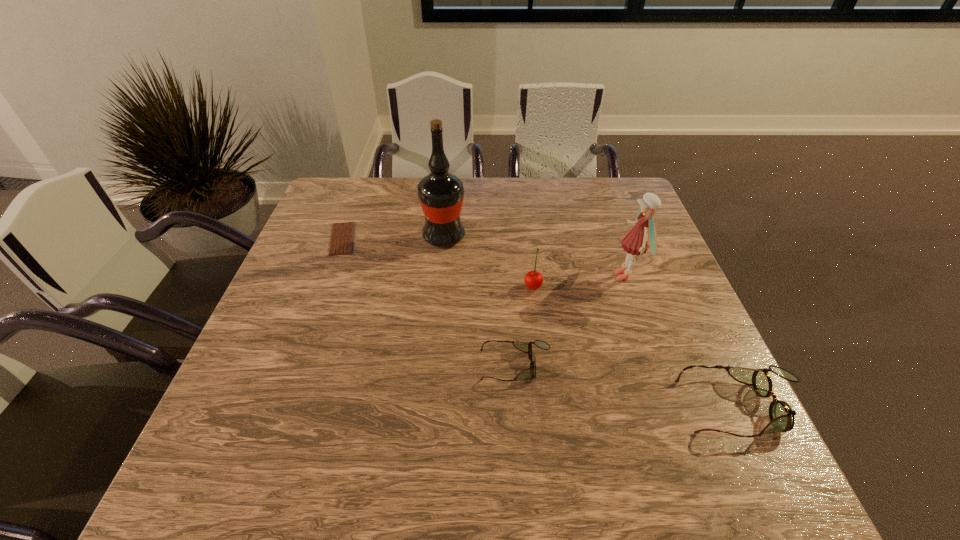
In the image, there is a desktop. Identify the location of vacant space at the far left corner. The image size is (960, 540). (338, 199).

At what (x,y) coordinates should I click in order to perform the action: click on vacant space at the near right corner of the desktop. Please return your answer as a coordinate pair (x, y). Looking at the image, I should click on (742, 411).

Where is `free area in between the right spectacles and the cherry`? The height and width of the screenshot is (540, 960). free area in between the right spectacles and the cherry is located at coordinates (636, 346).

Identify the location of free space between the shorter spectacles and the third tallest object. (524, 326).

This screenshot has width=960, height=540. What are the coordinates of `empty space between the second tallest object and the tallest object` in the screenshot? It's located at (535, 256).

Locate an element on the screen. free space between the fifth object from right to left and the fifth shortest object is located at coordinates point(535,256).

The image size is (960, 540). Identify the location of free space between the shorter spectacles and the tallest object. (480, 301).

You are a GUI agent. You are given a task and a screenshot of the screen. Output one action in this format:
    pyautogui.click(x=<x>, y=<y>)
    Task: Click on the free space between the taller spectacles and the second tallest object
    The image size is (960, 540).
    Given the screenshot: What is the action you would take?
    pyautogui.click(x=684, y=341)

The image size is (960, 540). Find the location of `free area in between the shortest object and the cherry`. free area in between the shortest object and the cherry is located at coordinates (438, 262).

At what (x,y) coordinates should I click in order to perform the action: click on free space that is in between the shorter spectacles and the taller spectacles. Please return your answer as a coordinate pair (x, y). Image resolution: width=960 pixels, height=540 pixels. Looking at the image, I should click on (628, 386).